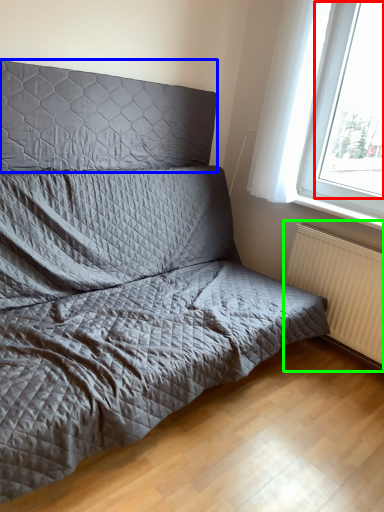
Question: Considering the real-world distances, which object is closest to window screen (highlighted by a red box)? headboard (highlighted by a blue box) or radiator (highlighted by a green box).

Choices:
 (A) headboard
 (B) radiator

Answer: (B)